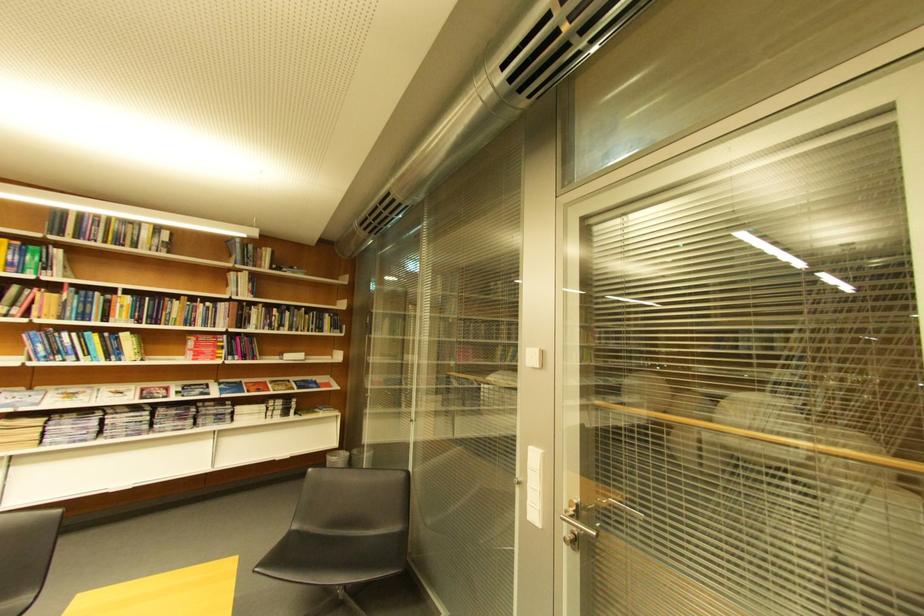
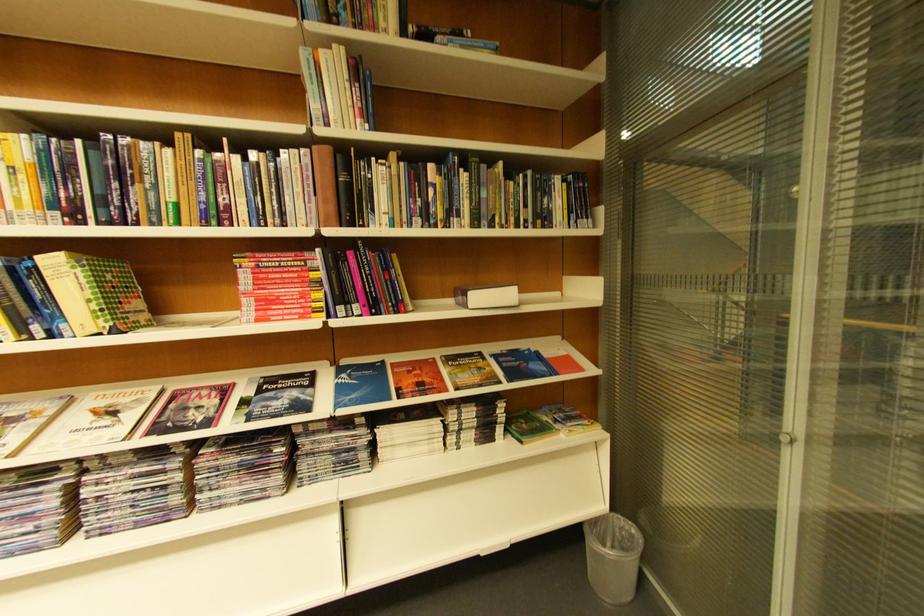
The point at (213, 339) is marked in the first image. Where is the corresponding point in the second image?

(281, 262)